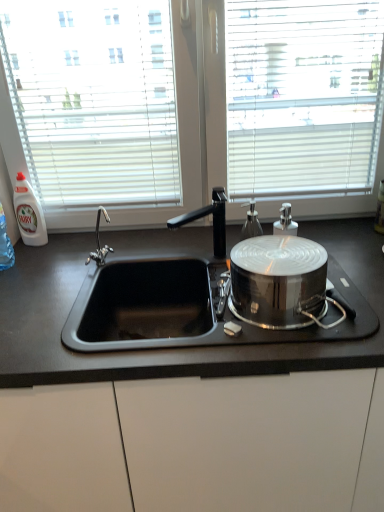
Question: Considering the relative positions of satin silver soap dispenser at center, marked as the 2th bottle in a left-to-right arrangement, and black matte countertop at center in the image provided, is satin silver soap dispenser at center, marked as the 2th bottle in a left-to-right arrangement, behind black matte countertop at center?

Choices:
 (A) yes
 (B) no

Answer: (A)

Question: From a real-world perspective, is satin silver soap dispenser at center, the 2th bottle when ordered from back to front, physically above black matte countertop at center?

Choices:
 (A) no
 (B) yes

Answer: (B)

Question: Is satin silver soap dispenser at center, the 2th bottle when ordered from back to front, bigger than black matte countertop at center?

Choices:
 (A) no
 (B) yes

Answer: (A)

Question: Is satin silver soap dispenser at center, the 2th bottle when ordered from back to front, thinner than black matte countertop at center?

Choices:
 (A) yes
 (B) no

Answer: (A)

Question: Is black matte countertop at center inside satin silver soap dispenser at center, marked as the 2th bottle in a left-to-right arrangement?

Choices:
 (A) yes
 (B) no

Answer: (B)

Question: Is satin silver soap dispenser at center, which is the 1th bottle in front-to-back order, shorter than black matte countertop at center?

Choices:
 (A) yes
 (B) no

Answer: (A)

Question: Considering the relative sizes of polished stainless steel pot at right and black matte countertop at center in the image provided, is polished stainless steel pot at right thinner than black matte countertop at center?

Choices:
 (A) yes
 (B) no

Answer: (A)

Question: From a real-world perspective, is polished stainless steel pot at right on top of black matte countertop at center?

Choices:
 (A) yes
 (B) no

Answer: (A)

Question: From a real-world perspective, is polished stainless steel pot at right beneath black matte countertop at center?

Choices:
 (A) no
 (B) yes

Answer: (A)

Question: Is polished stainless steel pot at right positioned before black matte countertop at center?

Choices:
 (A) no
 (B) yes

Answer: (B)

Question: Does polished stainless steel pot at right have a smaller size compared to black matte countertop at center?

Choices:
 (A) yes
 (B) no

Answer: (A)

Question: Is polished stainless steel pot at right at the left side of black matte countertop at center?

Choices:
 (A) no
 (B) yes

Answer: (A)

Question: Is white plastic bottle at left, the first bottle positioned from the back, inside black matte faucet at center?

Choices:
 (A) no
 (B) yes

Answer: (A)